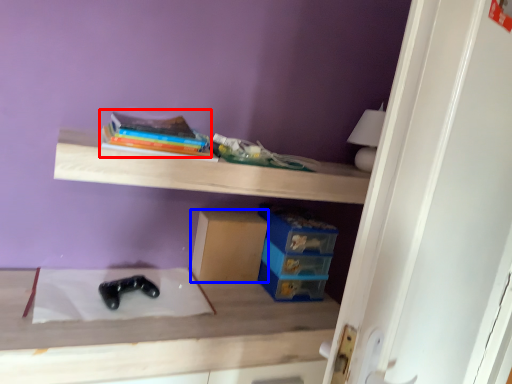
Question: Which object is further to the camera taking this photo, book (highlighted by a red box) or cardboard box (highlighted by a blue box)?

Choices:
 (A) book
 (B) cardboard box

Answer: (B)